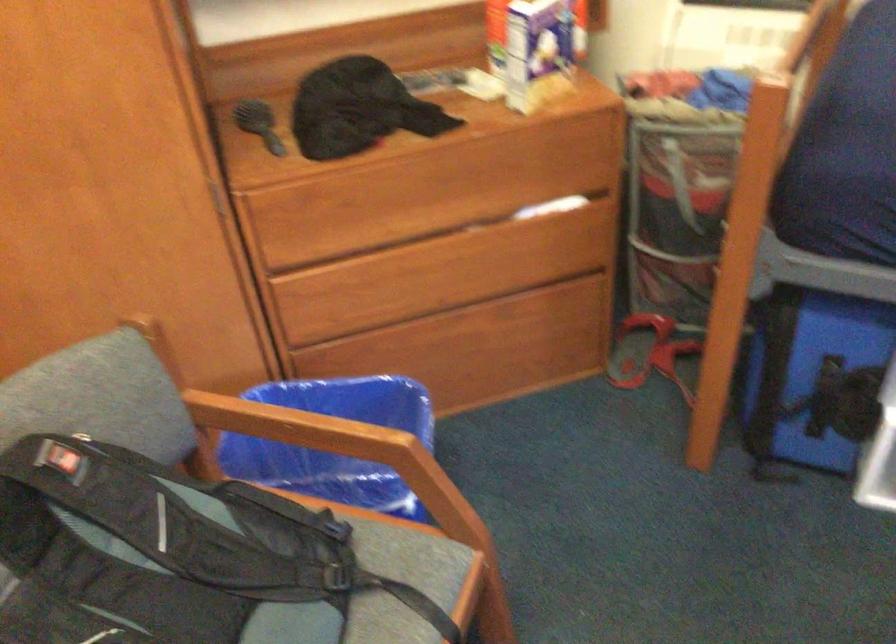
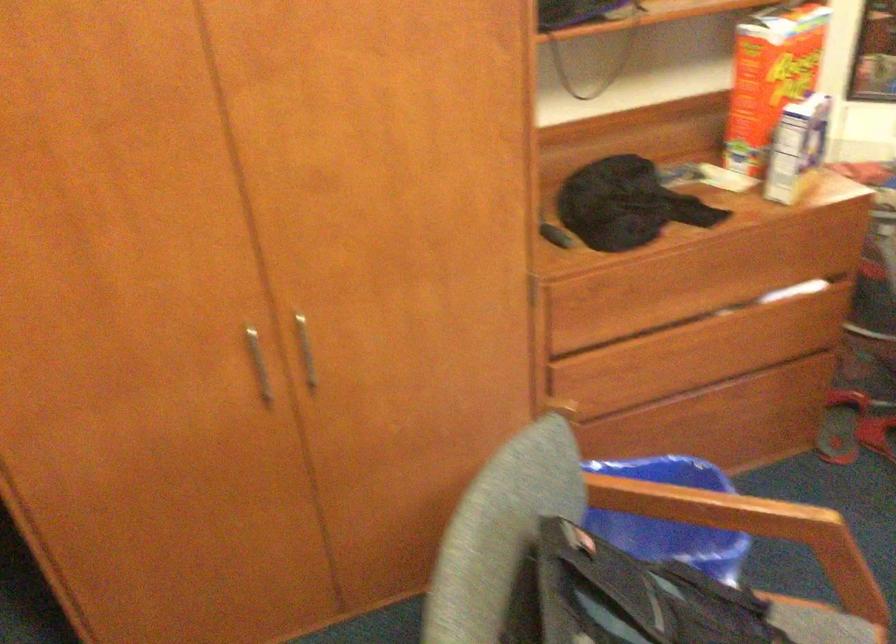
Question: The first image is from the beginning of the video and the second image is from the end. How did the camera likely rotate when shooting the video?

Choices:
 (A) Left
 (B) Right
 (C) Up
 (D) Down

Answer: (C)